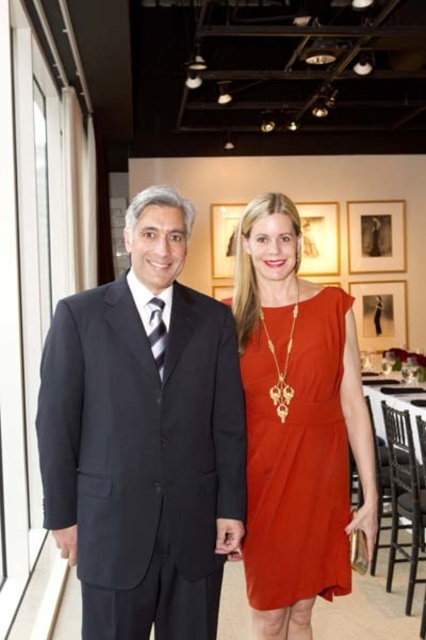
Question: In this image, where is black suit at left located relative to matte orange dress at center?

Choices:
 (A) left
 (B) right

Answer: (A)

Question: Which point appears farthest from the camera in this image?

Choices:
 (A) (265, 348)
 (B) (104, 480)

Answer: (A)

Question: Does black suit at left appear under matte orange dress at center?

Choices:
 (A) no
 (B) yes

Answer: (A)

Question: Can you confirm if black suit at left is bigger than matte orange dress at center?

Choices:
 (A) yes
 (B) no

Answer: (A)